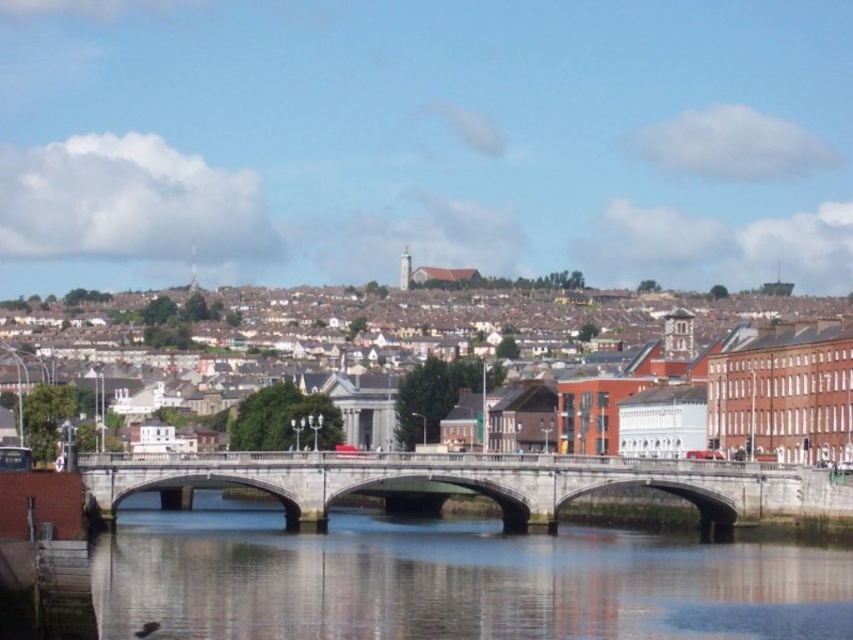
You are standing on the stone bridge and looking down. You see the clear water at center and the matte brick town at upper center. Which of these two objects is positioned higher from your viewpoint?

The matte brick town at upper center is positioned higher because it is located above the clear water at center.

In the scene shown: You are a delivery drone that needs to fly from the clear water at center to the concrete bridge at center. What is the minimum vertical distance you must maintain to safely pass between them?

The clear water at center and concrete bridge at center are 11.93 meters apart, so the minimum vertical distance you must maintain to safely pass between them is 11.93 meters.

You are a tourist standing on the concrete bridge at center and looking towards the matte brick town at upper center. Which structure appears larger in your view?

The matte brick town at upper center appears larger in your view because it is bigger than the concrete bridge at center.